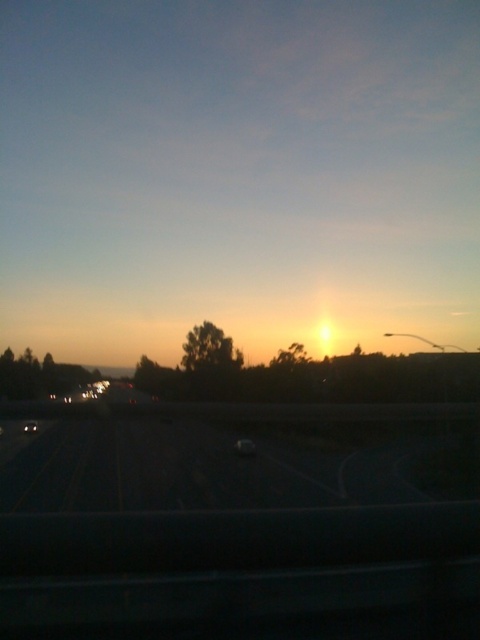
Question: Which point is closer to the camera taking this photo?

Choices:
 (A) (33, 420)
 (B) (253, 454)

Answer: (A)

Question: Can you confirm if yellow asphalt highway at lower center is positioned to the right of matte white car at center?

Choices:
 (A) yes
 (B) no

Answer: (A)

Question: Which point is farther from the camera taking this photo?

Choices:
 (A) pyautogui.click(x=240, y=452)
 (B) pyautogui.click(x=404, y=465)

Answer: (A)

Question: Among these points, which one is farthest from the camera?

Choices:
 (A) (242, 451)
 (B) (34, 422)
 (C) (238, 472)

Answer: (B)

Question: Can you confirm if shiny black car at center is wider than matte white car at center?

Choices:
 (A) yes
 (B) no

Answer: (B)

Question: Is yellow asphalt highway at lower center to the right of matte white car at center from the viewer's perspective?

Choices:
 (A) no
 (B) yes

Answer: (B)